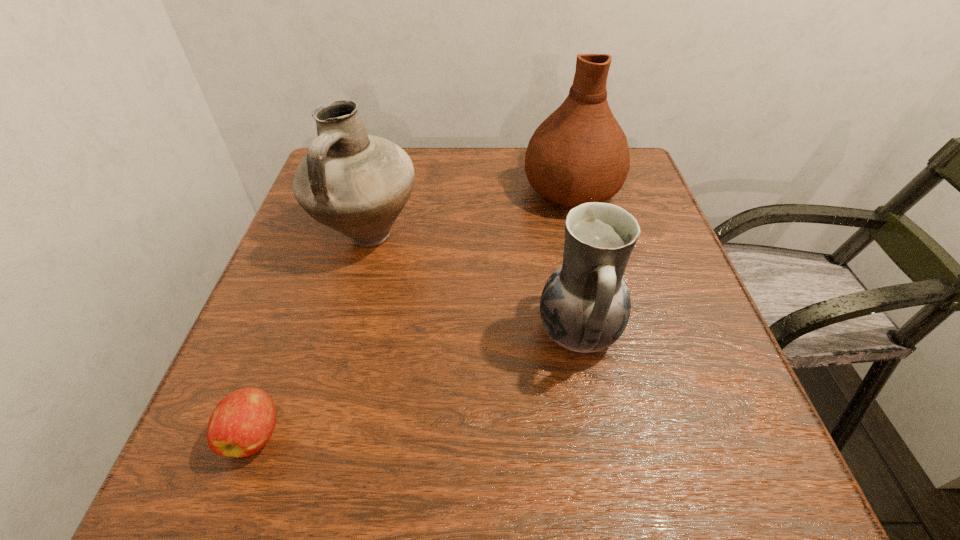
Find the location of a particular element. The height and width of the screenshot is (540, 960). object positioned at the far edge is located at coordinates (579, 154).

Identify the location of object that is at the near edge. (242, 423).

Identify the location of pitcher at the left edge. The height and width of the screenshot is (540, 960). (357, 184).

At what (x,y) coordinates should I click in order to perform the action: click on apple present at the left edge. Please return your answer as a coordinate pair (x, y). Looking at the image, I should click on (242, 423).

Find the location of `object that is at the right edge`. object that is at the right edge is located at coordinates (579, 154).

Find the location of a particular element. This screenshot has height=540, width=960. object that is at the near left corner is located at coordinates (242, 423).

Identify the location of object at the far right corner. (579, 154).

Locate an element on the screen. This screenshot has width=960, height=540. free region at the far edge of the desktop is located at coordinates (466, 157).

Find the location of `vacant space at the near edge of the desktop`. vacant space at the near edge of the desktop is located at coordinates (630, 458).

In the image, there is a desktop. Where is `vacant area at the left edge`? This screenshot has height=540, width=960. vacant area at the left edge is located at coordinates (303, 306).